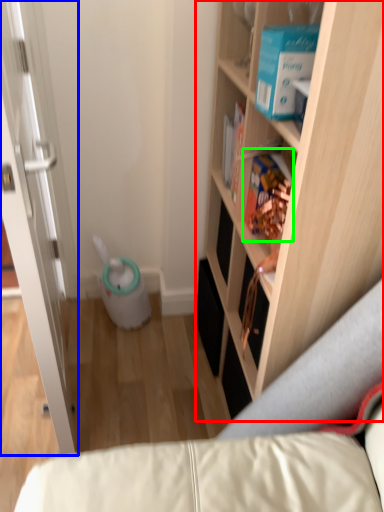
Question: Based on their relative distances, which object is nearer to cabinetry (highlighted by a red box)? Choose from door (highlighted by a blue box) and book (highlighted by a green box).

Choices:
 (A) door
 (B) book

Answer: (B)